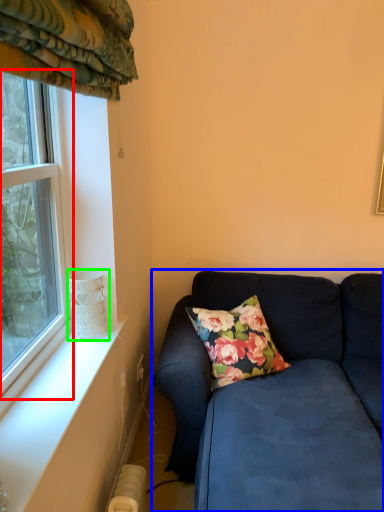
Question: Based on their relative distances, which object is farther from window (highlighted by a red box)? Choose from studio couch (highlighted by a blue box) and glass vase (highlighted by a green box).

Choices:
 (A) studio couch
 (B) glass vase

Answer: (A)